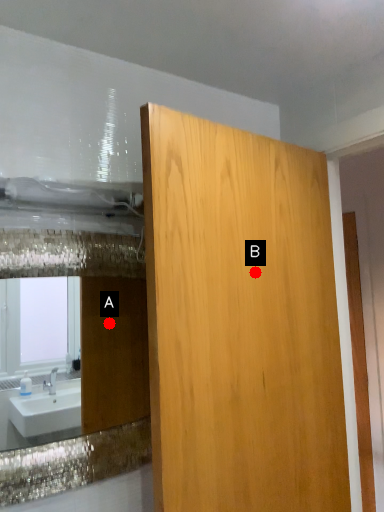
Question: Two points are circled on the image, labeled by A and B beside each circle. Which of the following is the closest to the observer?

Choices:
 (A) A is closer
 (B) B is closer

Answer: (B)